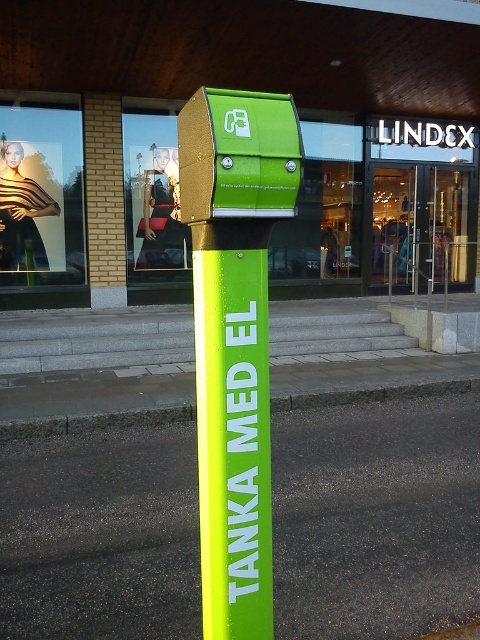
You are a delivery person with a 12 foot long electric scooter. You need to park your scooter between the neon green plastic post at center and the green rubber curb at lower center. Can your scooter fit in that space?

The distance between the neon green plastic post at center and the green rubber curb at lower center is 13.01 feet. Since your scooter is 12 feet long, it can fit within the space as there is enough room.

You are a delivery driver who needs to park your electric van near the neon green plastic post at center and the green rubber curb at lower center. Which object is smaller and should be avoided to prevent damage to your van?

The neon green plastic post at center is smaller than the green rubber curb at lower center, so it should be avoided to prevent damage to your van.

You are a delivery driver who needs to park your electric van near the neon green plastic post at center and the green rubber curb at lower center. Which object is higher up from the ground?

The neon green plastic post at center is above the green rubber curb at lower center, so the neon green plastic post at center is higher up from the ground.